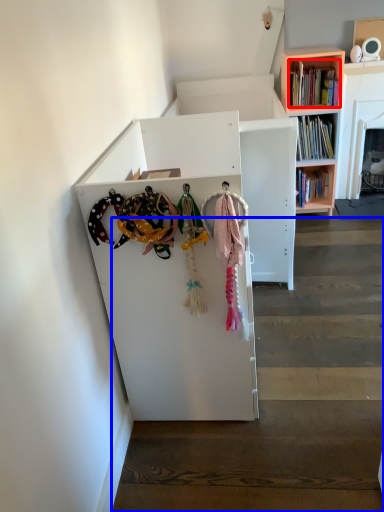
Question: Which of the following is the closest to the observer, book (highlighted by a red box) or stairwell (highlighted by a blue box)?

Choices:
 (A) book
 (B) stairwell

Answer: (B)